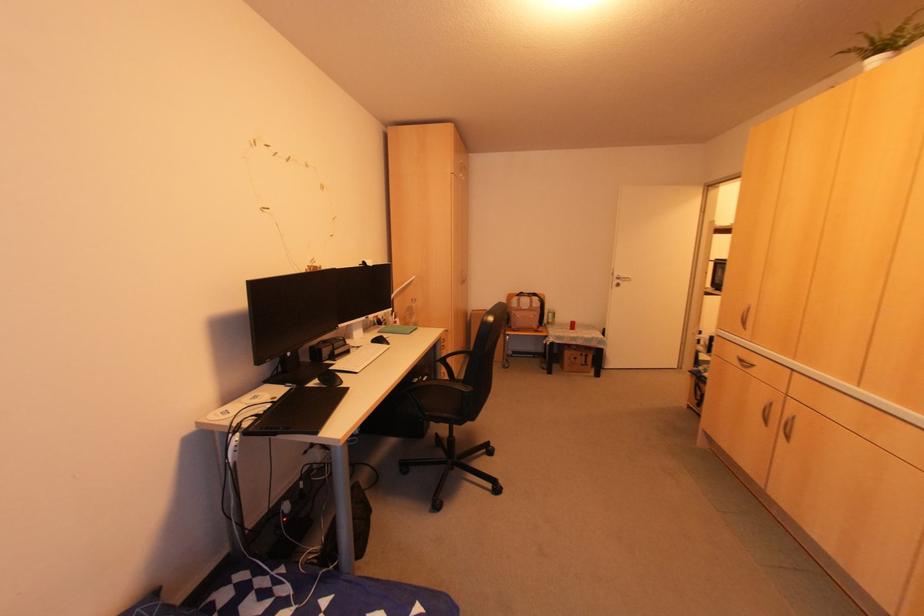
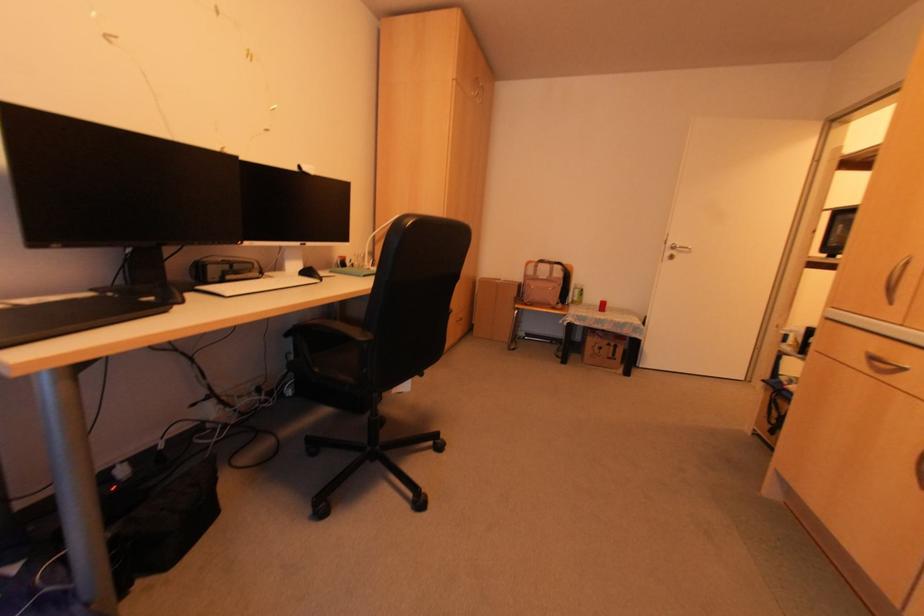
The point at (378, 339) is marked in the first image. Where is the corresponding point in the second image?

(305, 274)